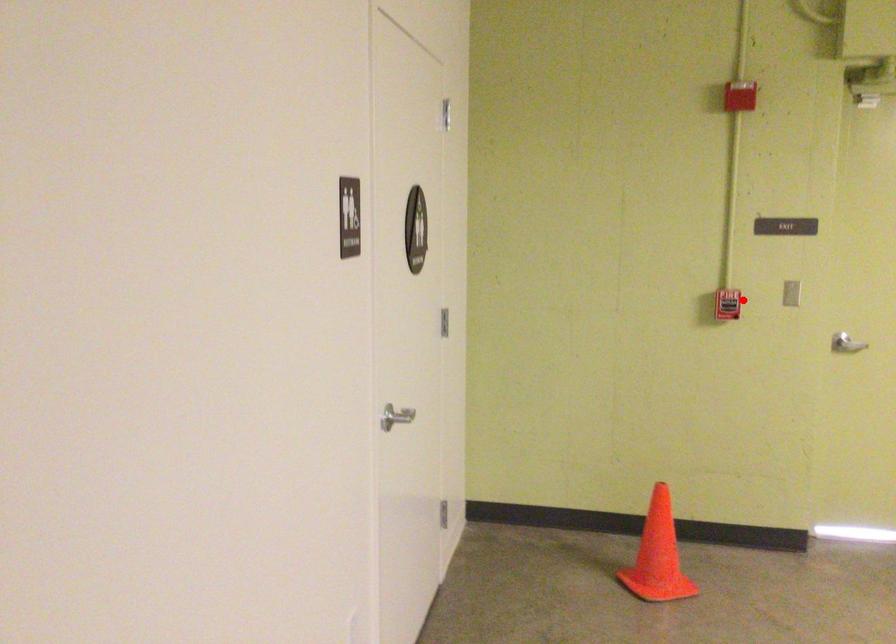
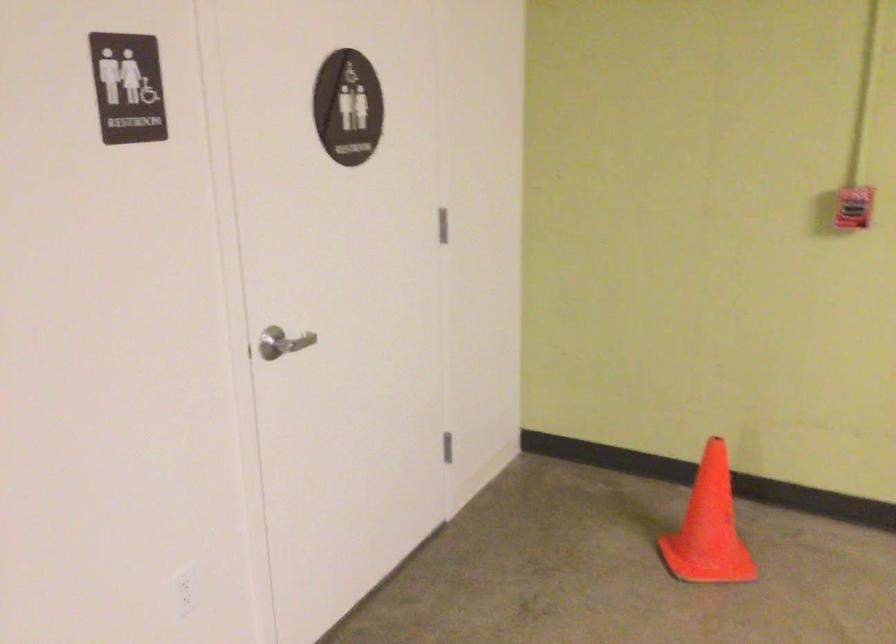
Question: I am providing you with two images of the same scene from different viewpoints. A red point is shown in image1. For the corresponding object point in image2, is it positioned nearer or farther from the camera?

Choices:
 (A) Nearer
 (B) Farther

Answer: (A)